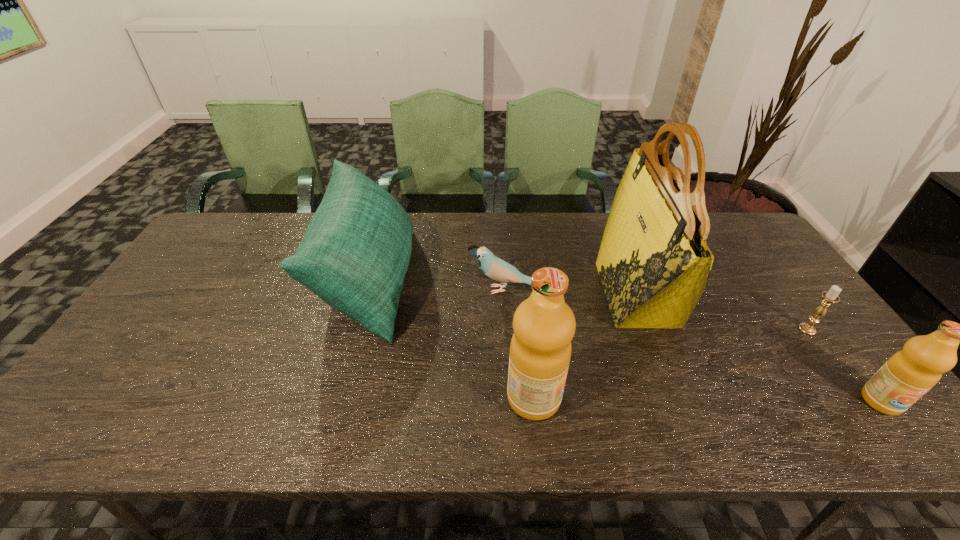
Please point a free position for a fruit juice on the left. Please provide its 2D coordinates. Your answer should be formatted as a tuple, i.e. [(x, y)], where the tuple contains the x and y coordinates of a point satisfying the conditions above.

[(190, 396)]